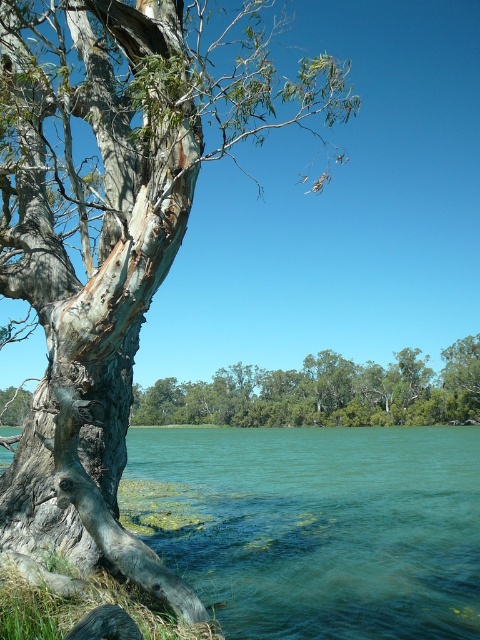
Question: Can you confirm if gray bark tree at left is thinner than green leafy trees at center?

Choices:
 (A) yes
 (B) no

Answer: (A)

Question: Is gray bark tree at left smaller than green leafy trees at center?

Choices:
 (A) no
 (B) yes

Answer: (A)

Question: Which point is farther to the camera?

Choices:
 (A) (97, 132)
 (B) (399, 500)

Answer: (B)

Question: Does gray bark tree at left have a greater width compared to green leafy trees at center?

Choices:
 (A) yes
 (B) no

Answer: (B)

Question: Based on their relative distances, which object is nearer to the gray bark tree at left?

Choices:
 (A) greenish water at lower left
 (B) green leafy trees at center

Answer: (A)

Question: Which object appears farthest from the camera in this image?

Choices:
 (A) greenish water at lower left
 (B) green leafy trees at center

Answer: (B)